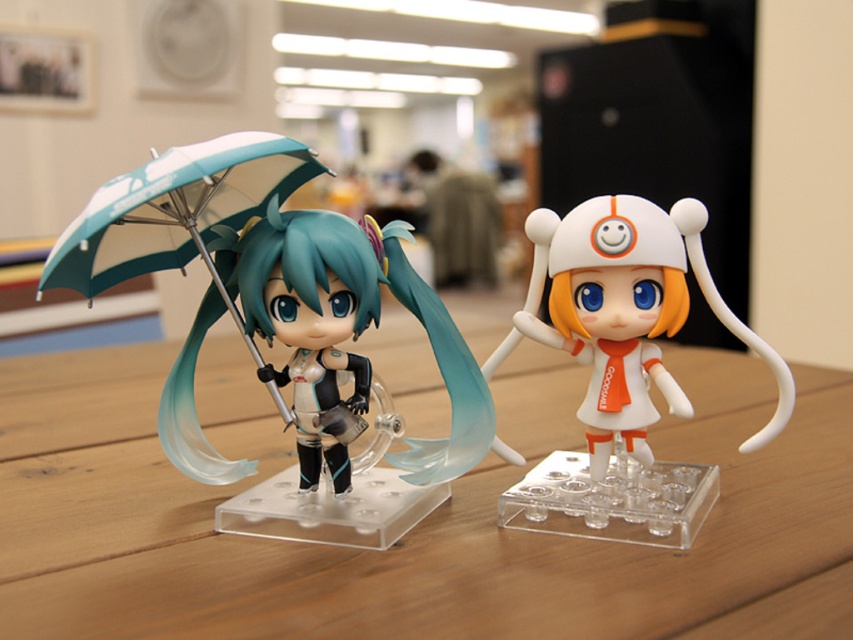
Question: Is wooden table at center positioned behind teal matte umbrella at left?

Choices:
 (A) yes
 (B) no

Answer: (B)

Question: Which point is farther to the camera?

Choices:
 (A) matte black figure at left
 (B) wooden table at center

Answer: (A)

Question: Is teal matte umbrella at left positioned at the back of matte black figure at left?

Choices:
 (A) yes
 (B) no

Answer: (B)

Question: Estimate the real-world distances between objects in this image. Which object is farther from the wooden table at center?

Choices:
 (A) teal matte umbrella at left
 (B) matte black figure at left
 (C) white matte plush toy at right

Answer: (A)

Question: Which point appears closest to the camera in this image?

Choices:
 (A) (213, 467)
 (B) (585, 577)

Answer: (B)

Question: Does wooden table at center have a larger size compared to matte black figure at left?

Choices:
 (A) yes
 (B) no

Answer: (A)